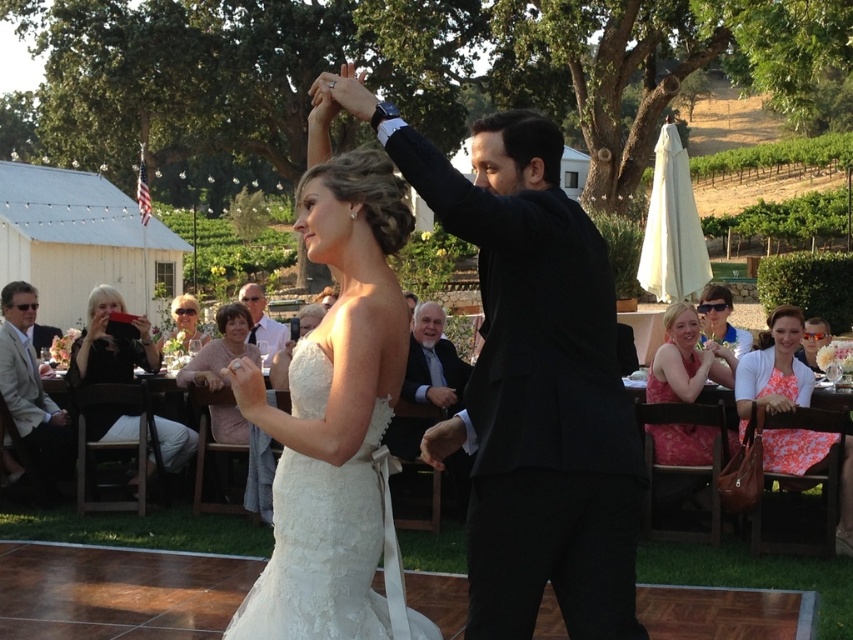
From the picture: Does white satin dress at center appear under black fabric camera at left?

No.

Is white satin dress at center in front of black fabric camera at left?

Yes, it is.

What do you see at coordinates (531, 378) in the screenshot? The height and width of the screenshot is (640, 853). I see `white satin dress at center` at bounding box center [531, 378].

What are the coordinates of `white satin dress at center` in the screenshot? It's located at (531, 378).

Is matte black suit at center below light brown hair at upper center?

Actually, matte black suit at center is above light brown hair at upper center.

Describe the element at coordinates (262, 321) in the screenshot. I see `matte black suit at center` at that location.

I want to click on matte black suit at center, so click(262, 321).

Measure the distance between orange floral dress at lower right and camera.

orange floral dress at lower right is 7.65 meters away from camera.

At what (x,y) coordinates should I click in order to perform the action: click on orange floral dress at lower right. Please return your answer as a coordinate pair (x, y). The image size is (853, 640). Looking at the image, I should click on (773, 369).

Is point (816, 452) closer to camera compared to point (9, 291)?

That is True.

This screenshot has height=640, width=853. Find the location of `orange floral dress at lower right`. orange floral dress at lower right is located at coordinates (773, 369).